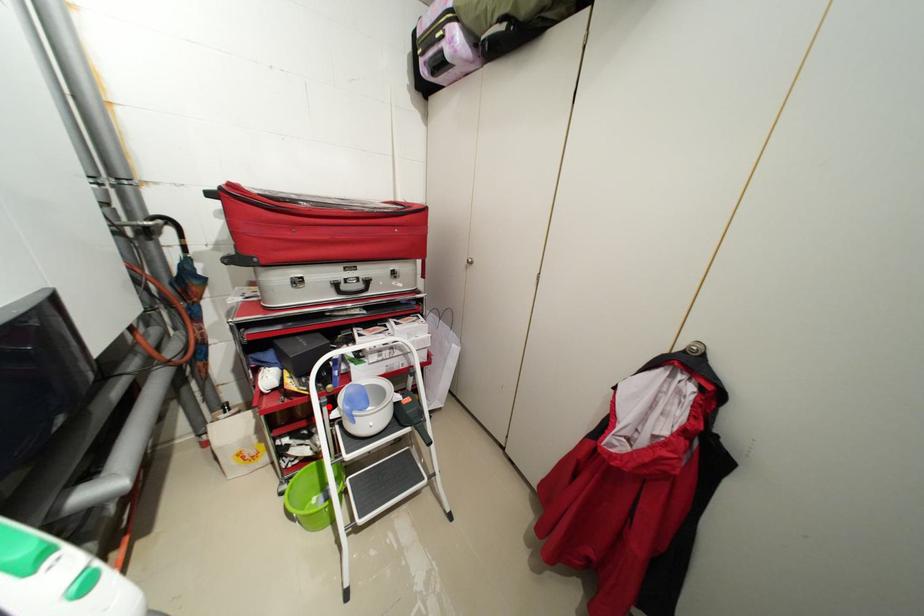
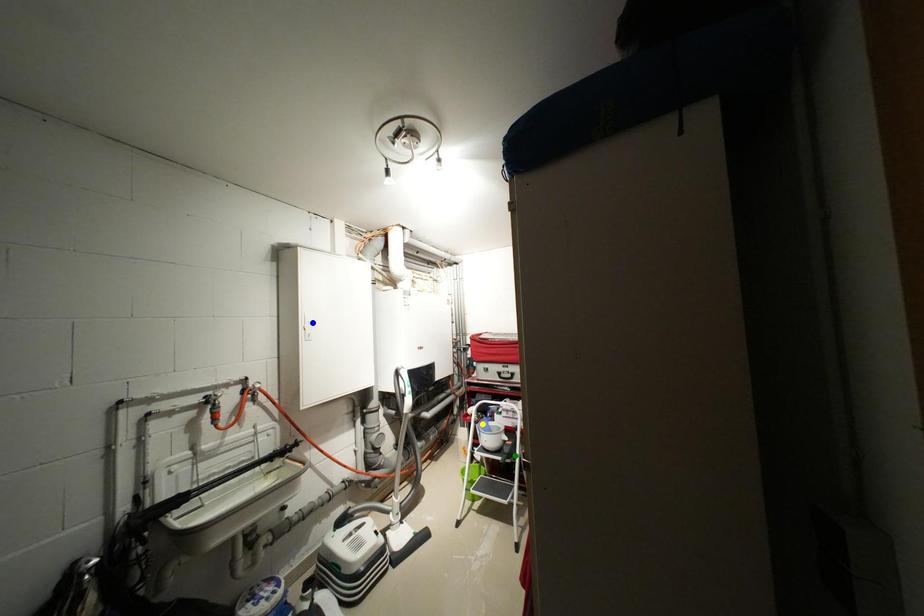
Question: I am providing you with two images of the same scene from different viewpoints. A red point is marked on the first image. You are given multiple points on the second image. Which point in image 2 represents the same 3d spot as the red point in image 1?

Choices:
 (A) blue point
 (B) yellow point
 (C) green point

Answer: (B)